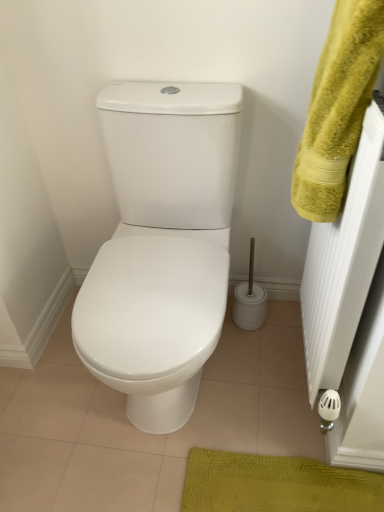
Question: Is point (322, 173) positioned closer to the camera than point (180, 389)?

Choices:
 (A) farther
 (B) closer

Answer: (B)

Question: In terms of width, does yellow fluffy towel at upper right look wider or thinner when compared to white glossy toilet at center?

Choices:
 (A) thin
 (B) wide

Answer: (A)

Question: Looking at the image, does yellow fluffy towel at upper right seem bigger or smaller compared to white glossy toilet at center?

Choices:
 (A) small
 (B) big

Answer: (A)

Question: From a real-world perspective, is white glossy toilet at center above or below yellow fluffy towel at upper right?

Choices:
 (A) above
 (B) below

Answer: (B)

Question: In the image, is white glossy toilet at center on the left side or the right side of yellow fluffy towel at upper right?

Choices:
 (A) left
 (B) right

Answer: (A)

Question: From their relative heights in the image, would you say white glossy toilet at center is taller or shorter than yellow fluffy towel at upper right?

Choices:
 (A) short
 (B) tall

Answer: (B)

Question: Is white glossy toilet at center in front of or behind yellow fluffy towel at upper right in the image?

Choices:
 (A) behind
 (B) front

Answer: (A)